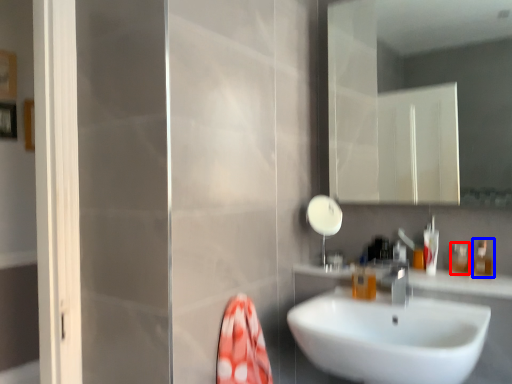
Question: Which point is further to the camera, toiletry (highlighted by a red box) or toiletry (highlighted by a blue box)?

Choices:
 (A) toiletry
 (B) toiletry

Answer: (A)